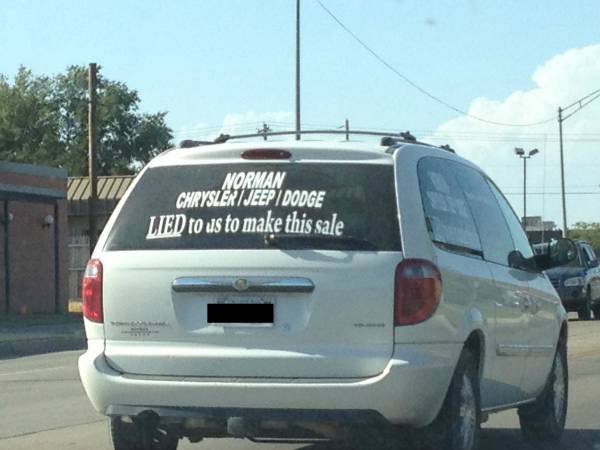
Locate an element on the screen. Image resolution: width=600 pixels, height=450 pixels. red lights is located at coordinates (415, 299), (92, 293).